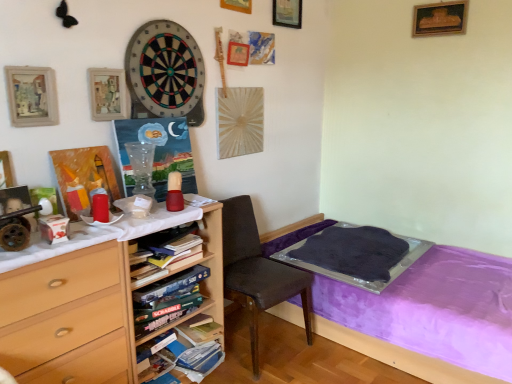
Image resolution: width=512 pixels, height=384 pixels. Identify the location of vacant location below brown fabric chair at center (from a real-world perspective). (262, 334).